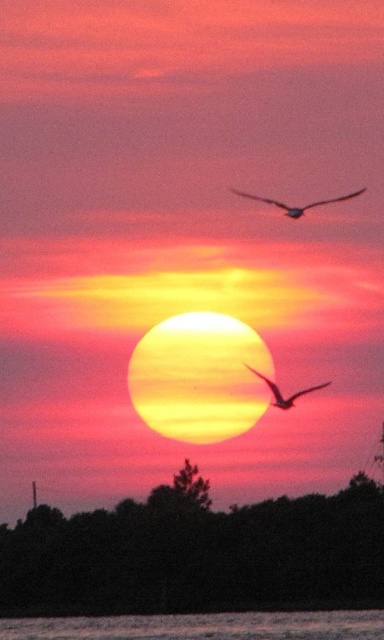
Is dark green leafy trees at lower center shorter than silhouette feathered bird at upper center?

Incorrect, dark green leafy trees at lower center's height does not fall short of silhouette feathered bird at upper center's.

Who is positioned more to the left, dark green leafy trees at lower center or silhouette feathered bird at upper center?

dark green leafy trees at lower center is more to the left.

What do you see at coordinates (196, 554) in the screenshot?
I see `dark green leafy trees at lower center` at bounding box center [196, 554].

You are a GUI agent. You are given a task and a screenshot of the screen. Output one action in this format:
    pyautogui.click(x=<x>, y=<y>)
    Task: Click on the dark green leafy trees at lower center
    The width and height of the screenshot is (384, 640).
    Given the screenshot: What is the action you would take?
    pyautogui.click(x=196, y=554)

Is point (301, 515) closer to camera compared to point (283, 408)?

No, (301, 515) is further to viewer.

Between dark green leafy trees at lower center and silhouette feathered bird at center, which one appears on the right side from the viewer's perspective?

From the viewer's perspective, silhouette feathered bird at center appears more on the right side.

This screenshot has height=640, width=384. Describe the element at coordinates (196, 554) in the screenshot. I see `dark green leafy trees at lower center` at that location.

Find the location of a particular element. The height and width of the screenshot is (640, 384). dark green leafy trees at lower center is located at coordinates (196, 554).

Between point (284, 211) and point (284, 397), which one is positioned behind?

Positioned behind is point (284, 397).

Is silhouette feathered bird at upper center smaller than silhouette feathered bird at center?

No, silhouette feathered bird at upper center is not smaller than silhouette feathered bird at center.

This screenshot has width=384, height=640. In order to click on silhouette feathered bird at upper center in this screenshot , I will do `click(296, 205)`.

The width and height of the screenshot is (384, 640). I want to click on silhouette feathered bird at upper center, so click(296, 205).